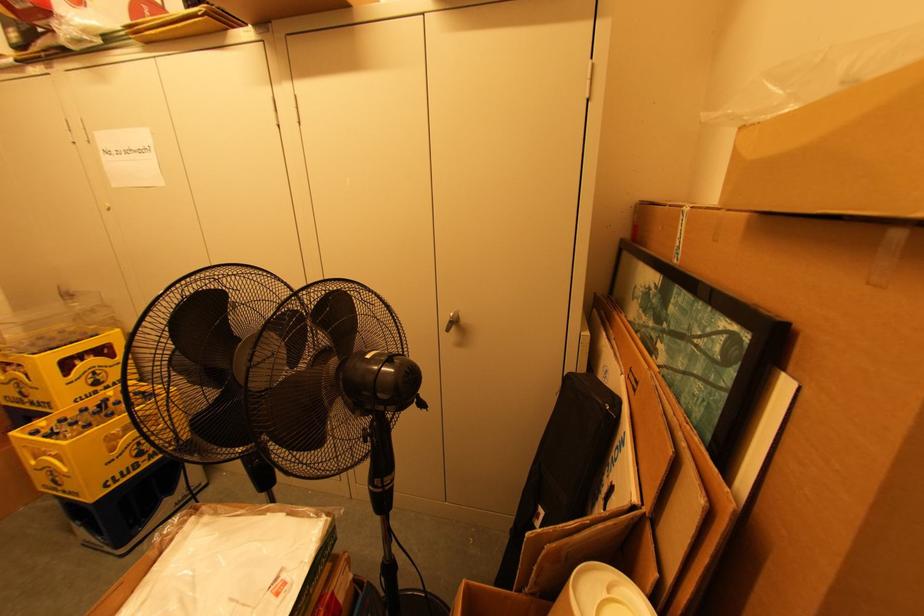
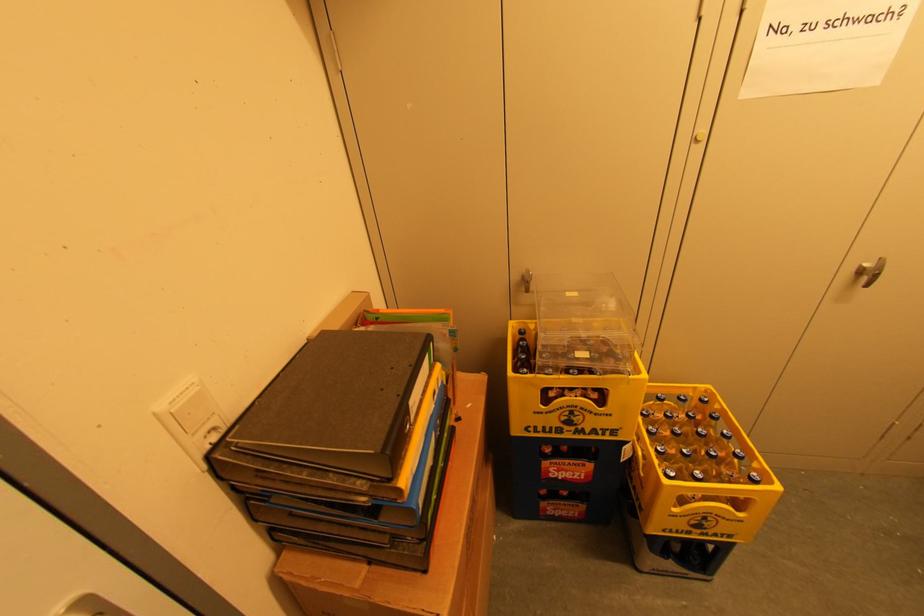
The point at (73, 493) is marked in the first image. Where is the corresponding point in the second image?

(718, 535)